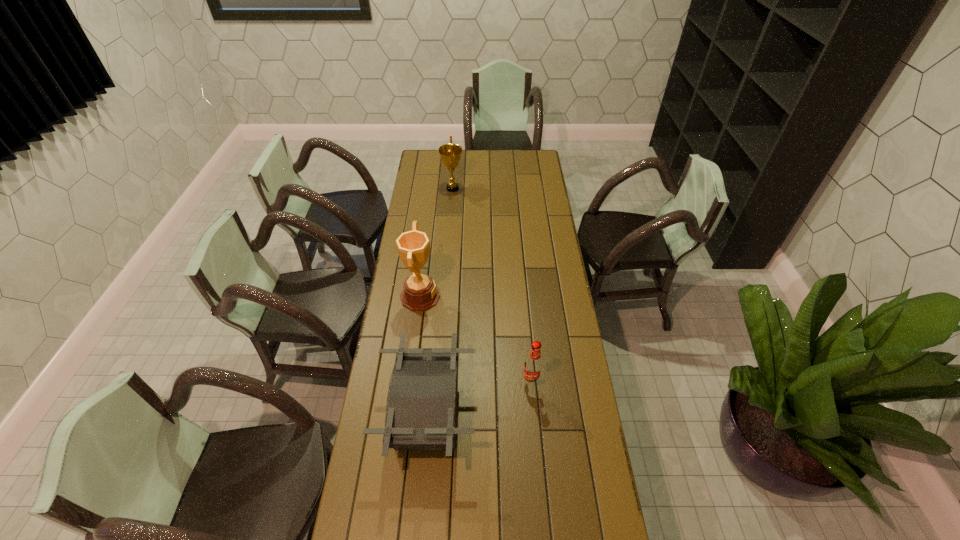
This screenshot has height=540, width=960. In order to click on the third nearest object in this screenshot , I will do `click(420, 293)`.

What are the coordinates of `the farther award` in the screenshot? It's located at (450, 154).

In order to click on the shorter award in this screenshot , I will do pyautogui.click(x=450, y=154).

Identify the location of the rightmost object. This screenshot has height=540, width=960. (533, 365).

At what (x,y) coordinates should I click in order to perform the action: click on root beer. Please return your answer as a coordinate pair (x, y). Looking at the image, I should click on (533, 365).

This screenshot has height=540, width=960. What are the coordinates of `the shortest object` in the screenshot? It's located at (421, 409).

The width and height of the screenshot is (960, 540). In order to click on vacant point located 0.180m on the front-facing side of the nearer award in this screenshot , I will do `click(481, 296)`.

The image size is (960, 540). I want to click on vacant space located on the front view with handles of the farther award, so click(x=527, y=188).

Find the location of a particular element. This screenshot has height=540, width=960. vacant area located 0.240m on the front of the rightmost object is located at coordinates click(538, 454).

Where is `vacant region located 0.240m with a camera mounted on the underside of the drone`? This screenshot has width=960, height=540. vacant region located 0.240m with a camera mounted on the underside of the drone is located at coordinates (543, 415).